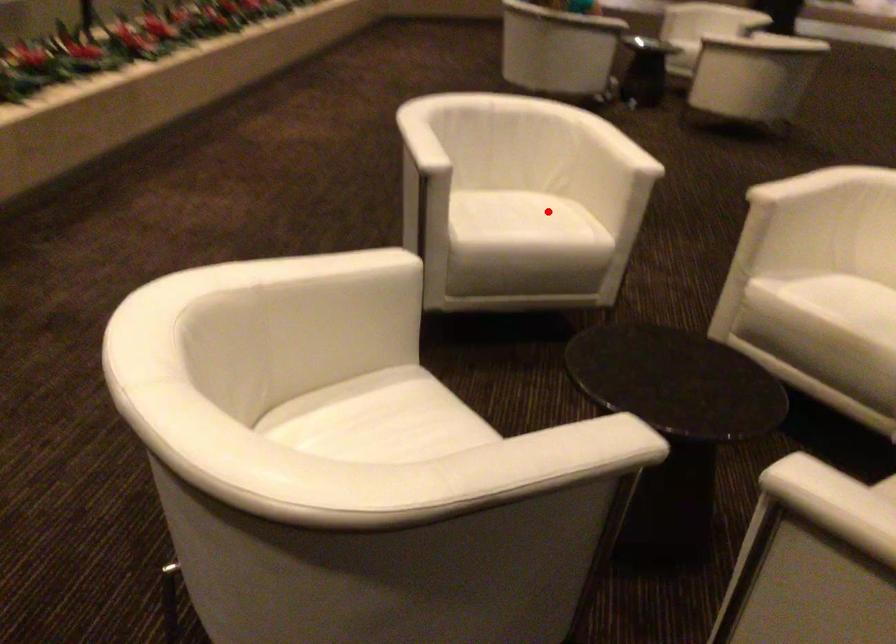
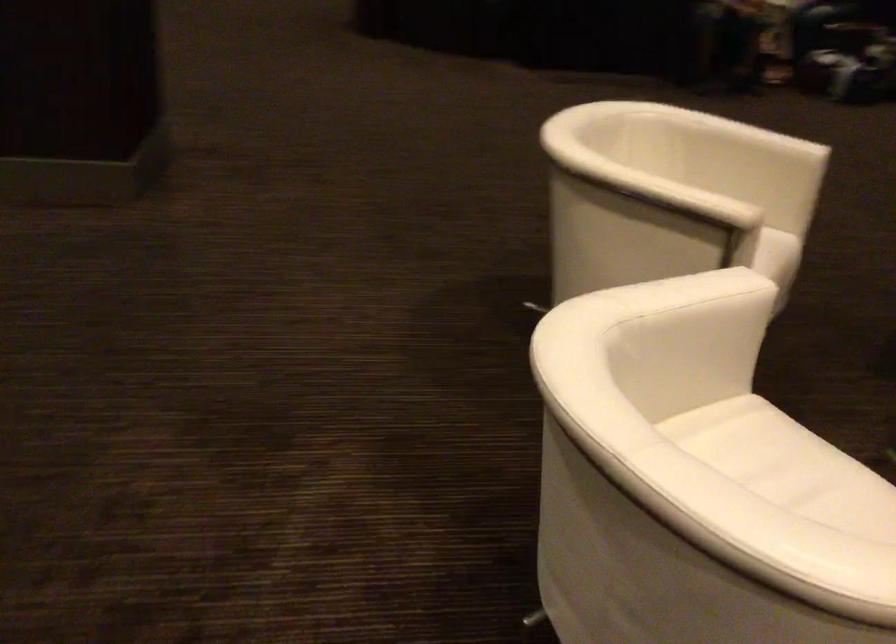
Question: I am providing you with two images of the same scene from different viewpoints. In image1, a red point is highlighted. Considering the same 3D point in image2, which of the following is correct?

Choices:
 (A) It is closer
 (B) It is farther

Answer: (A)